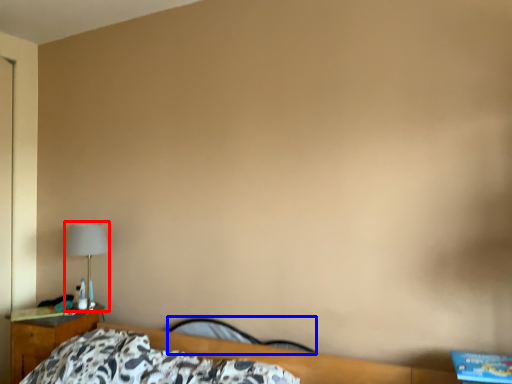
Question: Among these objects, which one is farthest to the camera, lamp (highlighted by a red box) or chair (highlighted by a blue box)?

Choices:
 (A) lamp
 (B) chair

Answer: (A)